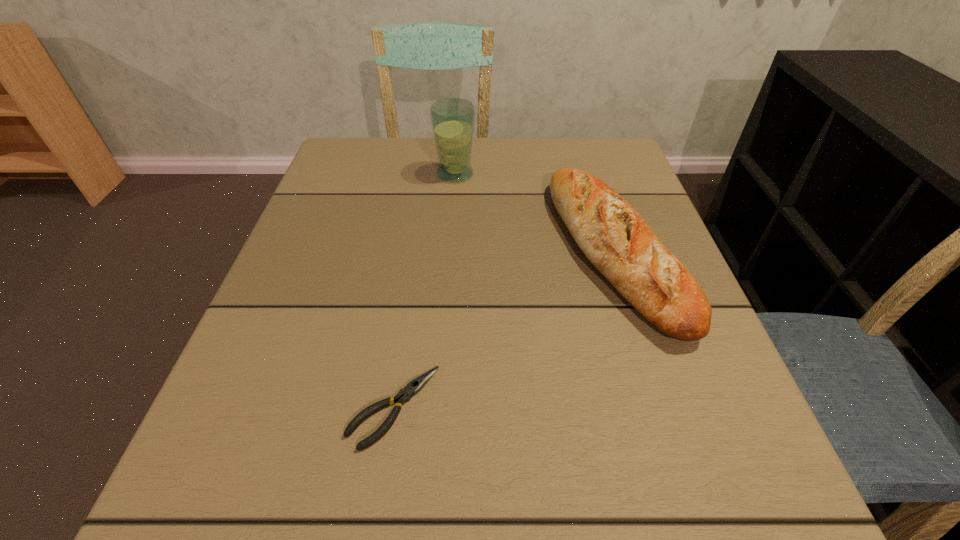
I want to click on object present at the right edge, so click(x=613, y=236).

Locate an element on the screen. This screenshot has height=540, width=960. object that is at the far right corner is located at coordinates (613, 236).

Locate an element on the screen. The width and height of the screenshot is (960, 540). free space at the far edge of the desktop is located at coordinates (516, 140).

You are a GUI agent. You are given a task and a screenshot of the screen. Output one action in this format:
    pyautogui.click(x=<x>, y=<y>)
    Task: Click on the vacant space at the near edge
    The width and height of the screenshot is (960, 540).
    Given the screenshot: What is the action you would take?
    pyautogui.click(x=477, y=487)

Image resolution: width=960 pixels, height=540 pixels. In the image, there is a desktop. Identify the location of free region at the left edge. (235, 443).

Image resolution: width=960 pixels, height=540 pixels. In order to click on free region at the right edge in this screenshot , I will do pos(704,406).

Where is `free spot at the far left corner of the desktop`? free spot at the far left corner of the desktop is located at coordinates (394, 174).

You are a GUI agent. You are given a task and a screenshot of the screen. Output one action in this format:
    pyautogui.click(x=<x>, y=<y>)
    Task: Click on the vacant region at the near left corner
    
    Given the screenshot: What is the action you would take?
    pyautogui.click(x=225, y=505)

In the image, there is a desktop. In order to click on vacant space at the far right corner in this screenshot , I will do `click(599, 144)`.

Find the location of a particular element. vacant space at the near right corner is located at coordinates (779, 511).